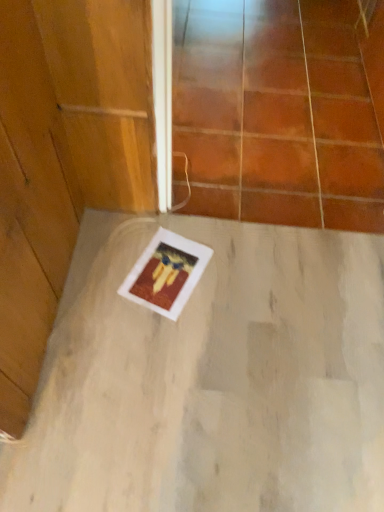
Question: Would you say transparent glass door at upper center is inside or outside white matte concrete at center?

Choices:
 (A) inside
 (B) outside

Answer: (B)

Question: Looking at the image, does transparent glass door at upper center seem bigger or smaller compared to white matte concrete at center?

Choices:
 (A) big
 (B) small

Answer: (A)

Question: Visually, is transparent glass door at upper center positioned to the left or to the right of white matte concrete at center?

Choices:
 (A) left
 (B) right

Answer: (B)

Question: From a real-world perspective, is white matte concrete at center above or below transparent glass door at upper center?

Choices:
 (A) above
 (B) below

Answer: (B)

Question: Is white matte concrete at center inside or outside of transparent glass door at upper center?

Choices:
 (A) inside
 (B) outside

Answer: (B)

Question: In terms of width, does white matte concrete at center look wider or thinner when compared to transparent glass door at upper center?

Choices:
 (A) thin
 (B) wide

Answer: (A)

Question: Is point (87, 509) closer or farther from the camera than point (253, 183)?

Choices:
 (A) farther
 (B) closer

Answer: (B)